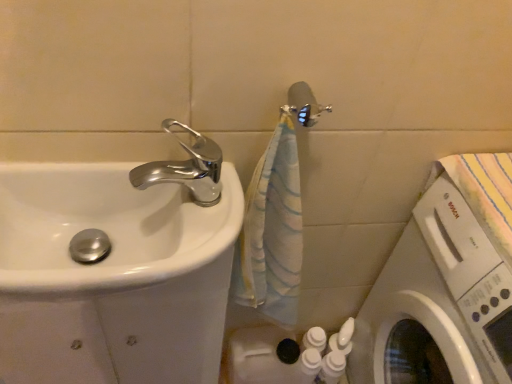
Question: Does white glossy washing machine at lower right have a lesser height compared to metallic silver shower head at upper center?

Choices:
 (A) yes
 (B) no

Answer: (B)

Question: Can you confirm if white glossy washing machine at lower right is wider than metallic silver shower head at upper center?

Choices:
 (A) yes
 (B) no

Answer: (A)

Question: From the image's perspective, is white glossy washing machine at lower right below metallic silver shower head at upper center?

Choices:
 (A) no
 (B) yes

Answer: (B)

Question: Does white glossy washing machine at lower right turn towards metallic silver shower head at upper center?

Choices:
 (A) no
 (B) yes

Answer: (B)

Question: Is white glossy washing machine at lower right facing away from metallic silver shower head at upper center?

Choices:
 (A) no
 (B) yes

Answer: (A)

Question: Is white glossy sink at left inside the boundaries of metallic silver shower head at upper center, or outside?

Choices:
 (A) inside
 (B) outside

Answer: (B)

Question: Is point (38, 269) closer or farther from the camera than point (303, 97)?

Choices:
 (A) closer
 (B) farther

Answer: (A)

Question: Looking at their shapes, would you say white glossy sink at left is wider or thinner than metallic silver shower head at upper center?

Choices:
 (A) wide
 (B) thin

Answer: (A)

Question: Visually, is white glossy sink at left positioned to the left or to the right of metallic silver shower head at upper center?

Choices:
 (A) left
 (B) right

Answer: (A)

Question: Would you say chrome metallic faucet at upper left is to the left or to the right of white glossy sink at left in the picture?

Choices:
 (A) left
 (B) right

Answer: (B)

Question: From their relative heights in the image, would you say chrome metallic faucet at upper left is taller or shorter than white glossy sink at left?

Choices:
 (A) tall
 (B) short

Answer: (B)

Question: Is chrome metallic faucet at upper left inside the boundaries of white glossy sink at left, or outside?

Choices:
 (A) outside
 (B) inside

Answer: (A)

Question: From the image's perspective, is chrome metallic faucet at upper left positioned above or below white glossy sink at left?

Choices:
 (A) above
 (B) below

Answer: (A)

Question: Considering the positions of point (170, 248) and point (371, 332), is point (170, 248) closer or farther from the camera than point (371, 332)?

Choices:
 (A) closer
 (B) farther

Answer: (A)

Question: Is white glossy sink at left in front of or behind white glossy washing machine at lower right in the image?

Choices:
 (A) front
 (B) behind

Answer: (B)